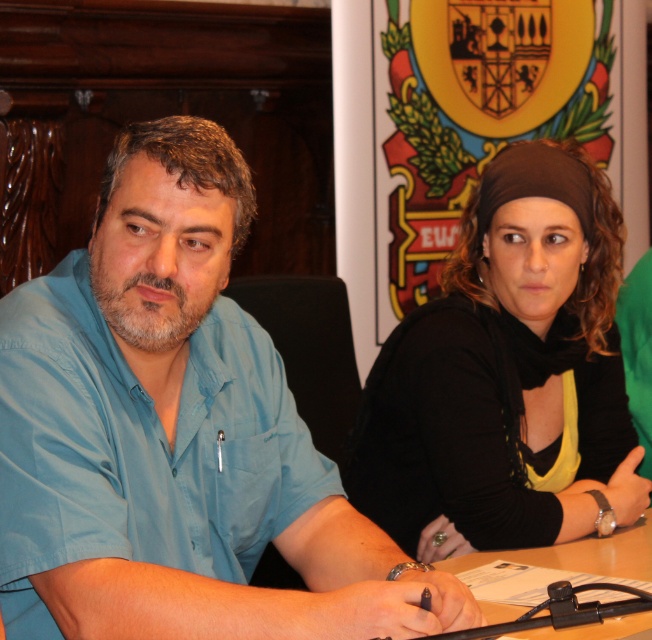
Question: Is blue cotton shirt at left bigger than black matte headscarf at upper right?

Choices:
 (A) yes
 (B) no

Answer: (A)

Question: Which object is farther from the camera taking this photo?

Choices:
 (A) black matte headscarf at upper right
 (B) blue cotton shirt at left

Answer: (A)

Question: Does blue cotton shirt at left lie in front of black matte headscarf at upper right?

Choices:
 (A) no
 (B) yes

Answer: (B)

Question: Which point appears farthest from the camera in this image?

Choices:
 (A) (46, 628)
 (B) (447, 548)

Answer: (B)

Question: Which of the following is the closest to the observer?

Choices:
 (A) (557, 502)
 (B) (136, 580)

Answer: (B)

Question: Observing the image, what is the correct spatial positioning of blue cotton shirt at left in reference to black matte headscarf at upper right?

Choices:
 (A) left
 (B) right

Answer: (A)